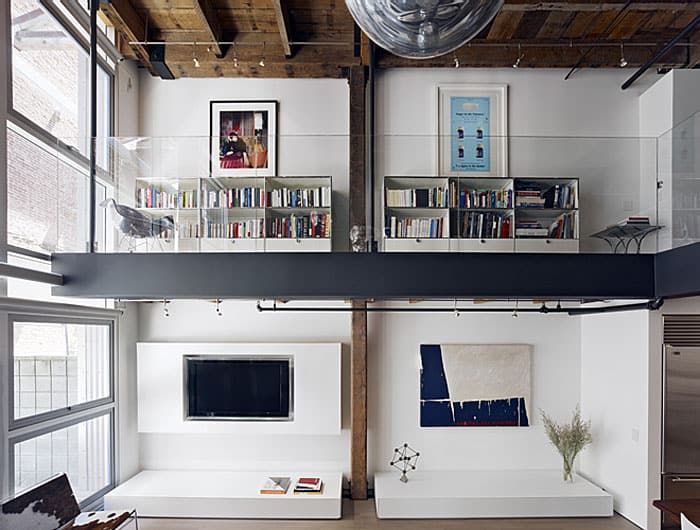
What are the coordinates of `shelf` in the screenshot? It's located at (537, 210).